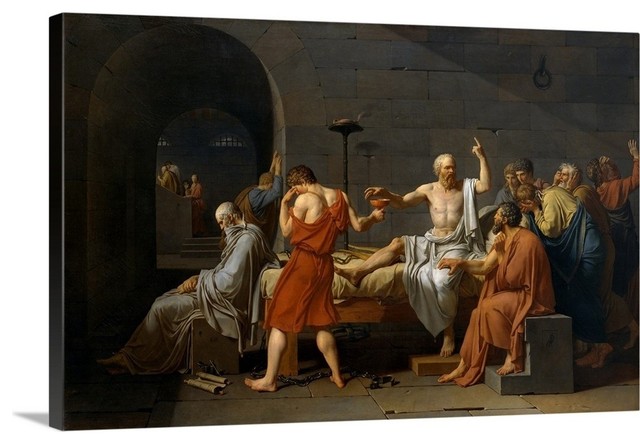
I want to click on doorway, so click(x=214, y=141).